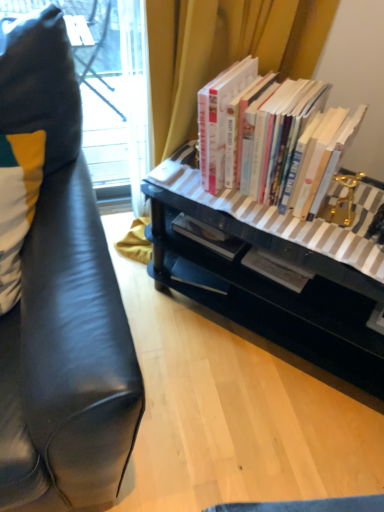
Question: Is hardcover books at center facing away from black glossy desk at center?

Choices:
 (A) yes
 (B) no

Answer: (B)

Question: From a real-world perspective, is hardcover books at center below black glossy desk at center?

Choices:
 (A) no
 (B) yes

Answer: (A)

Question: Is hardcover books at center to the right of black glossy desk at center from the viewer's perspective?

Choices:
 (A) yes
 (B) no

Answer: (B)

Question: Is hardcover books at center taller than black glossy desk at center?

Choices:
 (A) no
 (B) yes

Answer: (A)

Question: Does hardcover books at center turn towards black glossy desk at center?

Choices:
 (A) yes
 (B) no

Answer: (B)

Question: Is white and yellow fabric pillow at left taller or shorter than hardcover books at center?

Choices:
 (A) tall
 (B) short

Answer: (A)

Question: Considering the relative positions of white and yellow fabric pillow at left and hardcover books at center in the image provided, is white and yellow fabric pillow at left to the left or to the right of hardcover books at center?

Choices:
 (A) right
 (B) left

Answer: (B)

Question: Considering their positions, is white and yellow fabric pillow at left located in front of or behind hardcover books at center?

Choices:
 (A) front
 (B) behind

Answer: (A)

Question: From a real-world perspective, is white and yellow fabric pillow at left positioned above or below hardcover books at center?

Choices:
 (A) above
 (B) below

Answer: (A)

Question: Is hardcover books at center inside the boundaries of black glossy desk at center, or outside?

Choices:
 (A) outside
 (B) inside

Answer: (A)

Question: In the image, is hardcover books at center positioned in front of or behind black glossy desk at center?

Choices:
 (A) front
 (B) behind

Answer: (B)

Question: Does point (284, 176) appear closer or farther from the camera than point (192, 286)?

Choices:
 (A) farther
 (B) closer

Answer: (B)

Question: Is hardcover books at center wider or thinner than black glossy desk at center?

Choices:
 (A) thin
 (B) wide

Answer: (A)

Question: Which is correct: white and yellow fabric pillow at left is inside black glossy desk at center, or outside of it?

Choices:
 (A) outside
 (B) inside

Answer: (A)

Question: In the image, is white and yellow fabric pillow at left positioned in front of or behind black glossy desk at center?

Choices:
 (A) front
 (B) behind

Answer: (A)